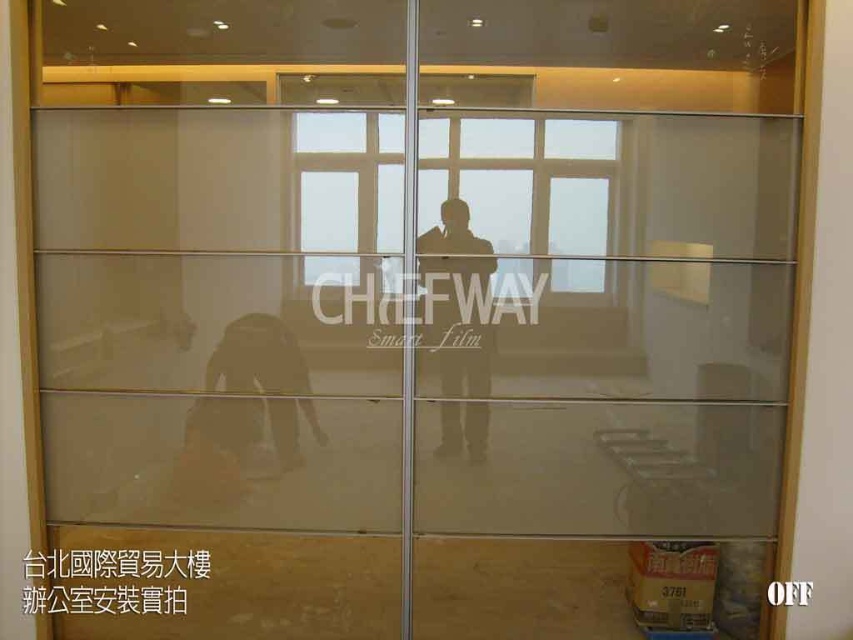
You are standing in an office and looking at the glass partition wall. You see two points marked on the glass partition wall. The first point is at coordinates point [448,195] and the second point is at point [492,332]. Which point is closer to you?

Point [448,195] is closer to the camera than point [492,332] according to the description.

You are an office worker who wants to see outside through the transparent glass window at center. However, there is a translucent glass person at center in the way. Can you still see outside clearly?

The transparent glass window at center is positioned over the translucent glass person at center, so the person is blocking your view. You cannot see outside clearly through the transparent glass window at center because the translucent glass person at center is in front of it.

You are an office worker who wants to check the weather outside through the transparent glass window at center and the translucent glass person at center. Which object allows you to see the outside more clearly?

The transparent glass window at center allows you to see the outside more clearly because it is transparent, while the translucent glass person at center diffuses light and reduces clarity.